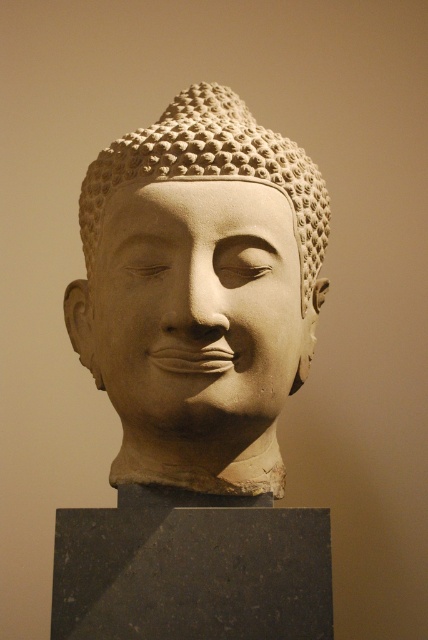
Question: Does white stone buddha head at center appear under smooth stone face at center?

Choices:
 (A) no
 (B) yes

Answer: (A)

Question: Which point appears closest to the camera in this image?

Choices:
 (A) (131, 460)
 (B) (142, 323)

Answer: (B)

Question: Is white stone buddha head at center positioned behind smooth stone face at center?

Choices:
 (A) yes
 (B) no

Answer: (A)

Question: Is the position of white stone buddha head at center more distant than that of smooth stone face at center?

Choices:
 (A) no
 (B) yes

Answer: (B)

Question: Which of the following is the farthest from the observer?

Choices:
 (A) (285, 166)
 (B) (205, 371)

Answer: (A)